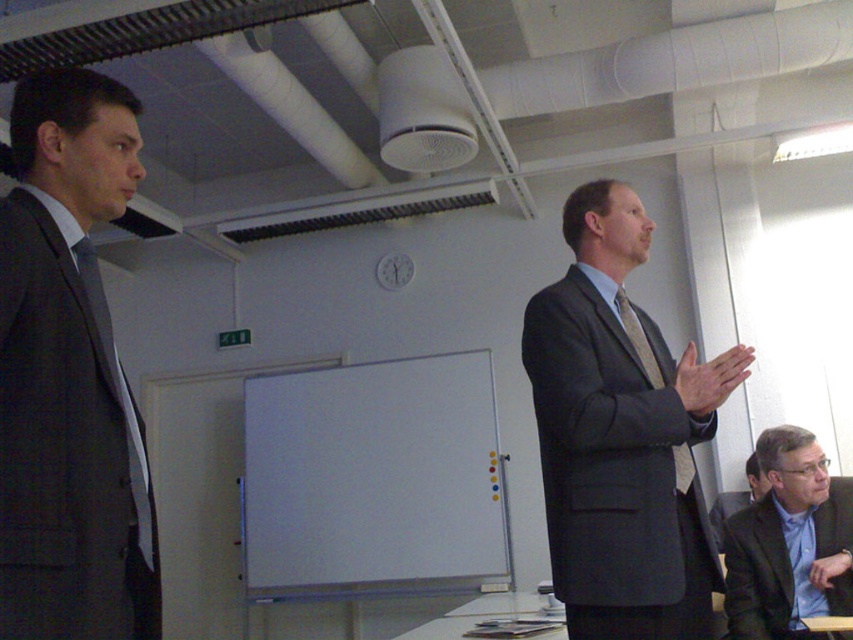
You are organizing a team photo and need to arrange the blue shirt at center and dark gray suit at right in a line. Which person should stand on the left side to maintain a balanced appearance?

To maintain balance, the blue shirt at center should stand on the left and the dark gray suit at right on the right since the blue shirt at center is thinner than the dark gray suit at right.

You are a security guard in the conference room. You need to locate the matte gray suit at center. Where is it positioned in terms of coordinates?

The matte gray suit at center is positioned at coordinates point (621, 435).

You are organizing a photo shoot and need to arrange the models based on their clothing height. Given the matte gray suit at left and the blue shirt at center, which clothing item should be placed first if you want to arrange them from tallest to shortest?

The matte gray suit at left should be placed first since it has a greater height compared to the blue shirt at center.